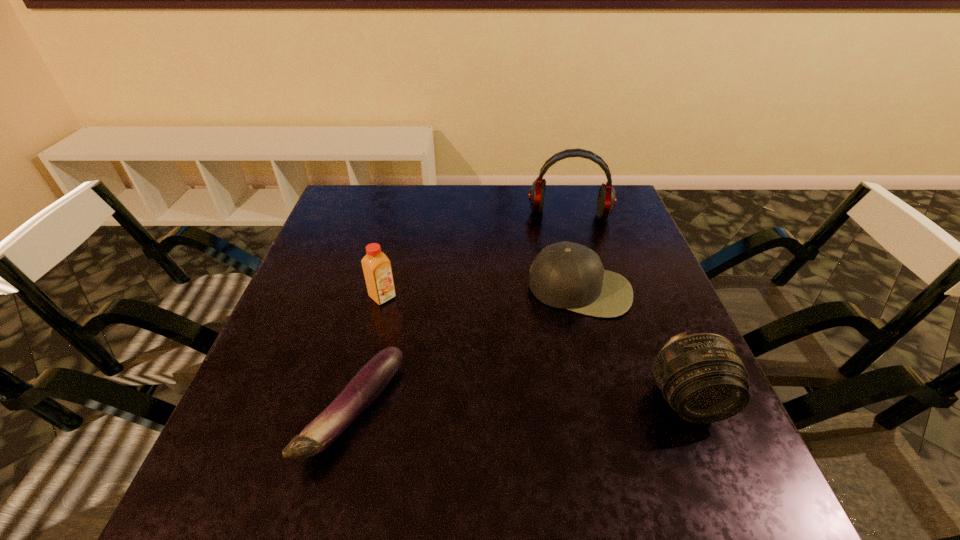
This screenshot has height=540, width=960. Identify the location of vacant area situated 0.090m on the front and back of the orange juice. (417, 323).

The height and width of the screenshot is (540, 960). I want to click on free location located on the front and back of the orange juice, so click(526, 409).

The width and height of the screenshot is (960, 540). What are the coordinates of `vacant space situated 0.120m on the front and back of the orange juice` in the screenshot? It's located at (425, 330).

Where is `free space located on the brim of the fourth tallest object`? Image resolution: width=960 pixels, height=540 pixels. free space located on the brim of the fourth tallest object is located at coordinates (567, 352).

Locate an element on the screen. free spot located 0.250m on the brim of the fourth tallest object is located at coordinates (558, 414).

At what (x,y) coordinates should I click in order to perform the action: click on free space located 0.100m on the brim of the fourth tallest object. Please return your answer as a coordinate pair (x, y). The width and height of the screenshot is (960, 540). Looking at the image, I should click on click(567, 352).

You are a GUI agent. You are given a task and a screenshot of the screen. Output one action in this format:
    pyautogui.click(x=<x>, y=<y>)
    Task: Click on the object that is positioned at the far edge
    The height and width of the screenshot is (540, 960).
    Given the screenshot: What is the action you would take?
    pyautogui.click(x=606, y=201)

Where is `eggplant at the near edge`? eggplant at the near edge is located at coordinates (365, 386).

Locate an element on the screen. This screenshot has width=960, height=540. telephoto lens located in the near edge section of the desktop is located at coordinates (703, 377).

At what (x,y) coordinates should I click in order to perform the action: click on object located in the left edge section of the desktop. Please return your answer as a coordinate pair (x, y). The image size is (960, 540). Looking at the image, I should click on (365, 386).